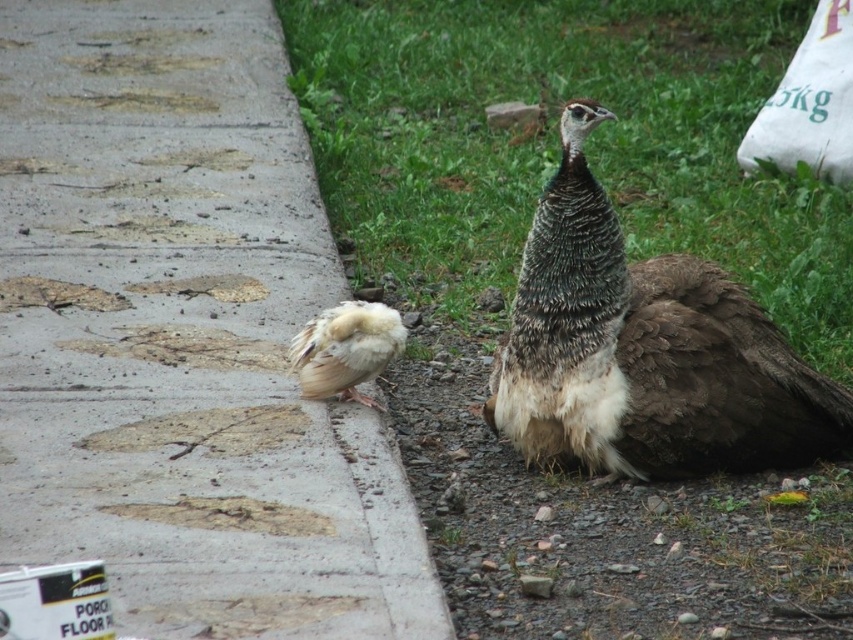
Question: Which of the following is the closest to the observer?

Choices:
 (A) (444, 134)
 (B) (379, 461)

Answer: (B)

Question: Which point is farther from the camera taking this photo?

Choices:
 (A) (328, 374)
 (B) (686, 356)

Answer: (A)

Question: Considering the relative positions of green grass at upper center and concrete at left in the image provided, where is green grass at upper center located with respect to concrete at left?

Choices:
 (A) left
 (B) right

Answer: (B)

Question: Does green grass at upper center have a smaller size compared to concrete at left?

Choices:
 (A) yes
 (B) no

Answer: (A)

Question: Is concrete at left smaller than white fluffy feather at left?

Choices:
 (A) no
 (B) yes

Answer: (A)

Question: Among these objects, which one is farthest from the camera?

Choices:
 (A) concrete at left
 (B) white fluffy feather at left
 (C) brown feathered peacock at lower right

Answer: (B)